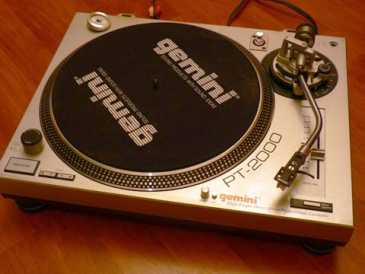
Find the location of a particular element. The width and height of the screenshot is (365, 274). record player is located at coordinates point(253,177).